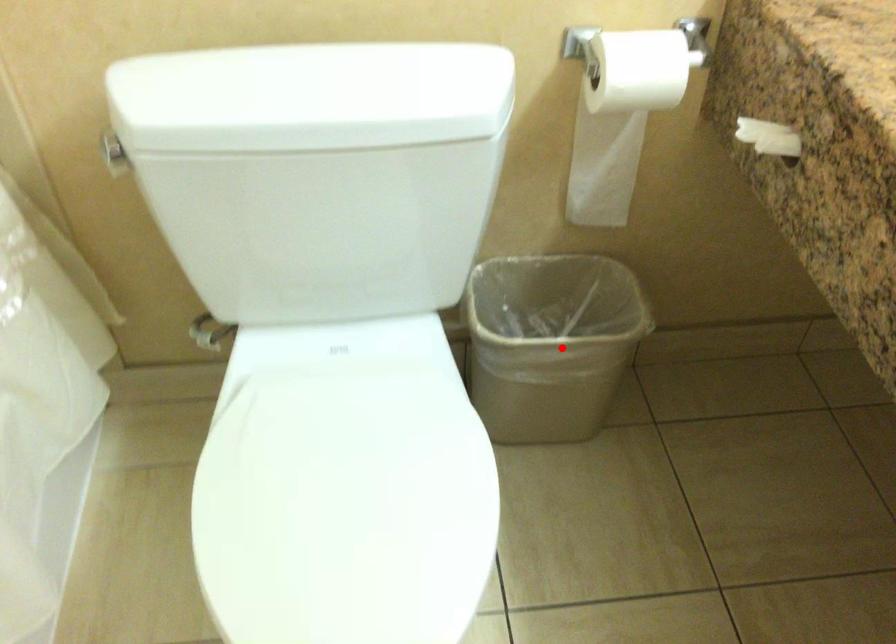
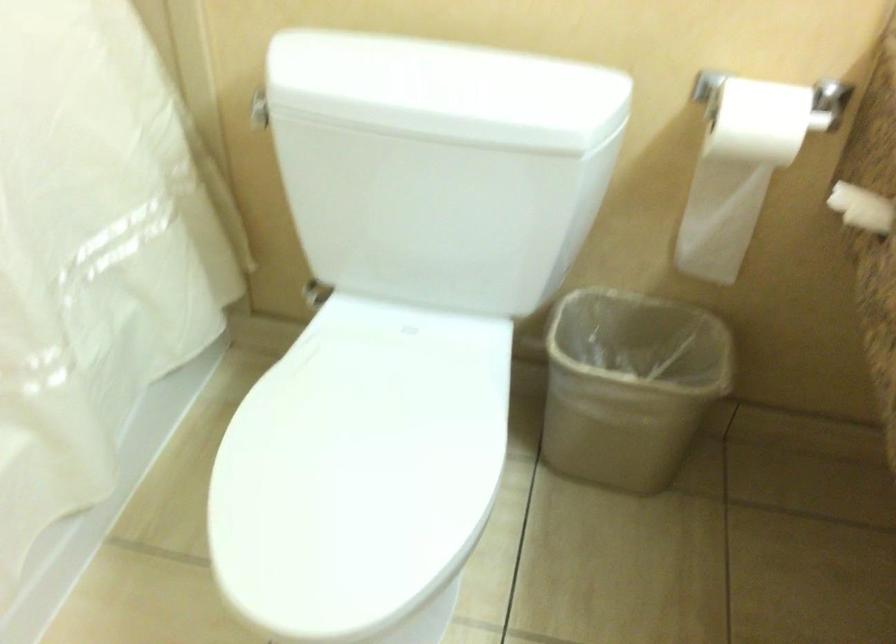
Find the pixel in the second image that matches the highlighted location in the first image.

(629, 384)